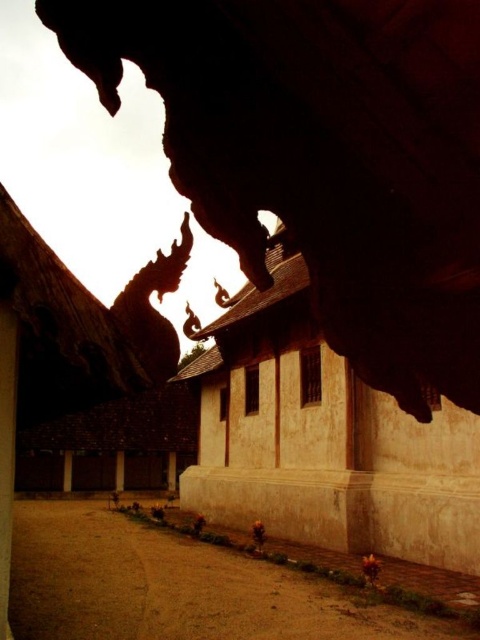
You are an architect examining the temple complex. You notice a specific point marked at coordinates (323,438). Based on the scene description, what architectural feature is located at this point?

The point at coordinates (323,438) marks the beige textured wall at center, which is part of the traditional architecture with weathered walls and ornate roof finials.

You are standing in front of the temple complex and want to determine the spatial relationship between two points of interest marked in the image. Which point, point (467, 568) or point (69, 452), is closer to you?

Point (467, 568) is closer to the viewer than point (69, 452).

You are a visitor standing at the entrance of the temple complex and want to walk from the brown wood pillar at lower left to the smooth stone pillar at center. How far will you have to walk in meters?

The brown wood pillar at lower left and smooth stone pillar at center are 5.93 meters apart from each other, so you will have to walk approximately 5.93 meters to reach the smooth stone pillar at center from the brown wood pillar at lower left.